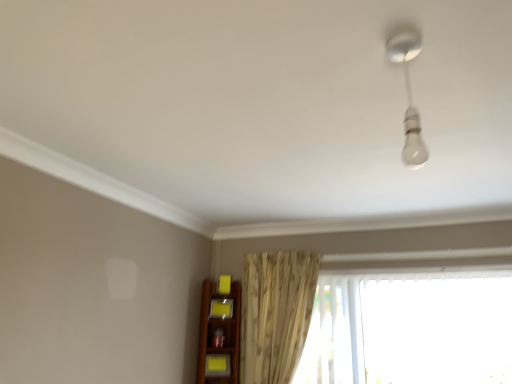
The height and width of the screenshot is (384, 512). What do you see at coordinates (408, 92) in the screenshot? I see `white glossy bulb at upper right` at bounding box center [408, 92].

Looking at this image, how much space does yellow matte shelf at lower center, which appears as the first shelf when viewed from the back, occupy horizontally?

1.78 inches.

What do you see at coordinates (218, 365) in the screenshot?
I see `matte yellow shelf at lower center, which is the first shelf in front-to-back order` at bounding box center [218, 365].

Describe the element at coordinates (275, 313) in the screenshot. I see `beige textured curtain at center` at that location.

This screenshot has height=384, width=512. What are the coordinates of `white glossy bulb at upper right` in the screenshot? It's located at (408, 92).

Is yellow matte shelf at lower center, the 2th shelf in the bottom-to-top sequence, positioned with its back to transparent plastic window at lower right?

No, transparent plastic window at lower right is not at the back of yellow matte shelf at lower center, the 2th shelf in the bottom-to-top sequence.

Is yellow matte shelf at lower center, which appears as the first shelf when viewed from the back, outside of transparent plastic window at lower right?

Yes, yellow matte shelf at lower center, which appears as the first shelf when viewed from the back, is outside of transparent plastic window at lower right.

Is yellow matte shelf at lower center, which ranks as the 2th shelf in front-to-back order, in front of or behind transparent plastic window at lower right in the image?

Visually, yellow matte shelf at lower center, which ranks as the 2th shelf in front-to-back order, is located behind transparent plastic window at lower right.

Between yellow matte shelf at lower center, the 2th shelf in the bottom-to-top sequence, and transparent plastic window at lower right, which one has less height?

Standing shorter between the two is yellow matte shelf at lower center, the 2th shelf in the bottom-to-top sequence.

Is white glossy bulb at upper right positioned before transparent plastic window at lower right?

Yes, white glossy bulb at upper right is closer to the viewer.

The width and height of the screenshot is (512, 384). What are the coordinates of `lamp above the transparent plastic window at lower right (from the image's perspective)` in the screenshot? It's located at (408, 92).

Is transparent plastic window at lower right inside white glossy bulb at upper right?

No.

Is white glossy bulb at upper right placed right next to transparent plastic window at lower right?

There is a gap between white glossy bulb at upper right and transparent plastic window at lower right.

Can you confirm if transparent plastic window at lower right is taller than beige textured curtain at center?

No.

From the image's perspective, is transparent plastic window at lower right beneath beige textured curtain at center?

Yes.

Does beige textured curtain at center appear on the right side of matte yellow shelf at lower center, positioned as the 2th shelf in back-to-front order?

Correct, you'll find beige textured curtain at center to the right of matte yellow shelf at lower center, positioned as the 2th shelf in back-to-front order.

Is beige textured curtain at center positioned with its back to matte yellow shelf at lower center, positioned as the 2th shelf in back-to-front order?

beige textured curtain at center is not turned away from matte yellow shelf at lower center, positioned as the 2th shelf in back-to-front order.

In the scene shown: Is beige textured curtain at center situated inside matte yellow shelf at lower center, the 1th shelf from the bottom, or outside?

beige textured curtain at center is not inside matte yellow shelf at lower center, the 1th shelf from the bottom, it's outside.

From a real-world perspective, which is physically above, beige textured curtain at center or matte yellow shelf at lower center, the second shelf positioned from the top?

From a 3D spatial view, beige textured curtain at center is above.

Is point (417, 168) in front of point (228, 313)?

Yes, point (417, 168) is closer to viewer.

Considering the relative sizes of white glossy bulb at upper right and yellow matte shelf at lower center, the 2th shelf in the bottom-to-top sequence, in the image provided, is white glossy bulb at upper right taller than yellow matte shelf at lower center, the 2th shelf in the bottom-to-top sequence,?

Correct, white glossy bulb at upper right is much taller as yellow matte shelf at lower center, the 2th shelf in the bottom-to-top sequence.

Is yellow matte shelf at lower center, which ranks as the 2th shelf in front-to-back order, completely or partially inside white glossy bulb at upper right?

No, yellow matte shelf at lower center, which ranks as the 2th shelf in front-to-back order, is located outside of white glossy bulb at upper right.

From a real-world perspective, which object rests below the other?

From a 3D spatial view, yellow matte shelf at lower center, the 2th shelf in the bottom-to-top sequence, is below.

In the scene shown: Between transparent plastic window at lower right and matte yellow shelf at lower center, the second shelf positioned from the top, which one has less height?

matte yellow shelf at lower center, the second shelf positioned from the top.

Where is `window that is on the right side of matte yellow shelf at lower center, the 1th shelf from the bottom`? The height and width of the screenshot is (384, 512). window that is on the right side of matte yellow shelf at lower center, the 1th shelf from the bottom is located at coordinates (410, 329).

Considering the positions of point (455, 291) and point (220, 364), is point (455, 291) closer or farther from the camera than point (220, 364)?

Point (455, 291) is positioned closer to the camera compared to point (220, 364).

Is matte yellow shelf at lower center, the second shelf positioned from the top, a part of transparent plastic window at lower right?

No, matte yellow shelf at lower center, the second shelf positioned from the top, is located outside of transparent plastic window at lower right.

From a real-world perspective, is matte yellow shelf at lower center, the second shelf positioned from the top, beneath transparent plastic window at lower right?

Yes, from a real-world perspective, matte yellow shelf at lower center, the second shelf positioned from the top, is beneath transparent plastic window at lower right.

Is matte yellow shelf at lower center, the second shelf positioned from the top, wider than transparent plastic window at lower right?

Incorrect, the width of matte yellow shelf at lower center, the second shelf positioned from the top, does not surpass that of transparent plastic window at lower right.

Is matte yellow shelf at lower center, the second shelf positioned from the top, oriented away from transparent plastic window at lower right?

No, transparent plastic window at lower right is not at the back of matte yellow shelf at lower center, the second shelf positioned from the top.

Find the location of `window that is in front of the yellow matte shelf at lower center, which appears as the first shelf when viewed from the back`. window that is in front of the yellow matte shelf at lower center, which appears as the first shelf when viewed from the back is located at coordinates (410, 329).

Image resolution: width=512 pixels, height=384 pixels. I want to click on window on the right of white glossy bulb at upper right, so click(410, 329).

Based on their spatial positions, is matte yellow shelf at lower center, which is the first shelf in front-to-back order, or beige textured curtain at center further from white glossy bulb at upper right?

Among the two, matte yellow shelf at lower center, which is the first shelf in front-to-back order, is located further to white glossy bulb at upper right.

When comparing their distances from matte yellow shelf at lower center, positioned as the 2th shelf in back-to-front order, does transparent plastic window at lower right or yellow matte shelf at lower center, which ranks as the 2th shelf in front-to-back order, seem closer?

Among the two, yellow matte shelf at lower center, which ranks as the 2th shelf in front-to-back order, is located nearer to matte yellow shelf at lower center, positioned as the 2th shelf in back-to-front order.

When comparing their distances from white glossy bulb at upper right, does yellow matte shelf at lower center, which appears as the first shelf when viewed from the back, or beige textured curtain at center seem closer?

beige textured curtain at center is closer to white glossy bulb at upper right.

Considering their positions, is matte yellow shelf at lower center, which is the first shelf in front-to-back order, positioned further to white glossy bulb at upper right than yellow matte shelf at lower center, which ranks as the 2th shelf in front-to-back order?

matte yellow shelf at lower center, which is the first shelf in front-to-back order.

Considering their positions, is matte yellow shelf at lower center, positioned as the 2th shelf in back-to-front order, positioned closer to beige textured curtain at center than white glossy bulb at upper right?

Among the two, matte yellow shelf at lower center, positioned as the 2th shelf in back-to-front order, is located nearer to beige textured curtain at center.

Which object lies nearer to the anchor point yellow matte shelf at lower center, which appears as the first shelf when viewed from the back, matte yellow shelf at lower center, the second shelf positioned from the top, or white glossy bulb at upper right?

matte yellow shelf at lower center, the second shelf positioned from the top.

Based on their spatial positions, is white glossy bulb at upper right or yellow matte shelf at lower center, acting as the first shelf starting from the top, closer to transparent plastic window at lower right?

Among the two, yellow matte shelf at lower center, acting as the first shelf starting from the top, is located nearer to transparent plastic window at lower right.

In the scene shown: Based on their spatial positions, is white glossy bulb at upper right or beige textured curtain at center closer to matte yellow shelf at lower center, which is the first shelf in front-to-back order?

Based on the image, beige textured curtain at center appears to be nearer to matte yellow shelf at lower center, which is the first shelf in front-to-back order.

This screenshot has height=384, width=512. Identify the location of curtain situated between yellow matte shelf at lower center, which appears as the first shelf when viewed from the back, and transparent plastic window at lower right from left to right. (275, 313).

Locate an element on the screen. window located between white glossy bulb at upper right and yellow matte shelf at lower center, the 2th shelf in the bottom-to-top sequence, in the depth direction is located at coordinates [410, 329].

You are a GUI agent. You are given a task and a screenshot of the screen. Output one action in this format:
    pyautogui.click(x=<x>, y=<y>)
    Task: Click on the window between white glossy bulb at upper right and matte yellow shelf at lower center, the 1th shelf from the bottom, from front to back
    
    Given the screenshot: What is the action you would take?
    pyautogui.click(x=410, y=329)

Locate an element on the screen. The width and height of the screenshot is (512, 384). shelf located between matte yellow shelf at lower center, the 1th shelf from the bottom, and transparent plastic window at lower right in the left-right direction is located at coordinates (221, 308).